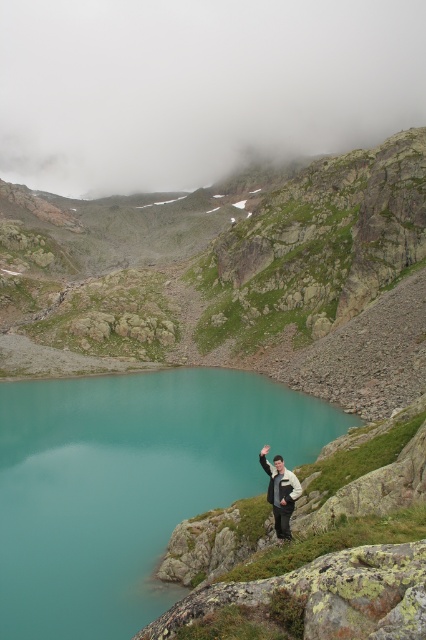
Question: Can you confirm if teal glassy lake at center is wider than white fleece jacket at lower right?

Choices:
 (A) no
 (B) yes

Answer: (B)

Question: Does teal glassy lake at center have a larger size compared to white fleece jacket at lower right?

Choices:
 (A) no
 (B) yes

Answer: (B)

Question: Is teal glassy lake at center further to camera compared to white fleece jacket at lower right?

Choices:
 (A) yes
 (B) no

Answer: (B)

Question: Which of the following is the closest to the observer?

Choices:
 (A) (103, 396)
 (B) (276, 481)

Answer: (B)